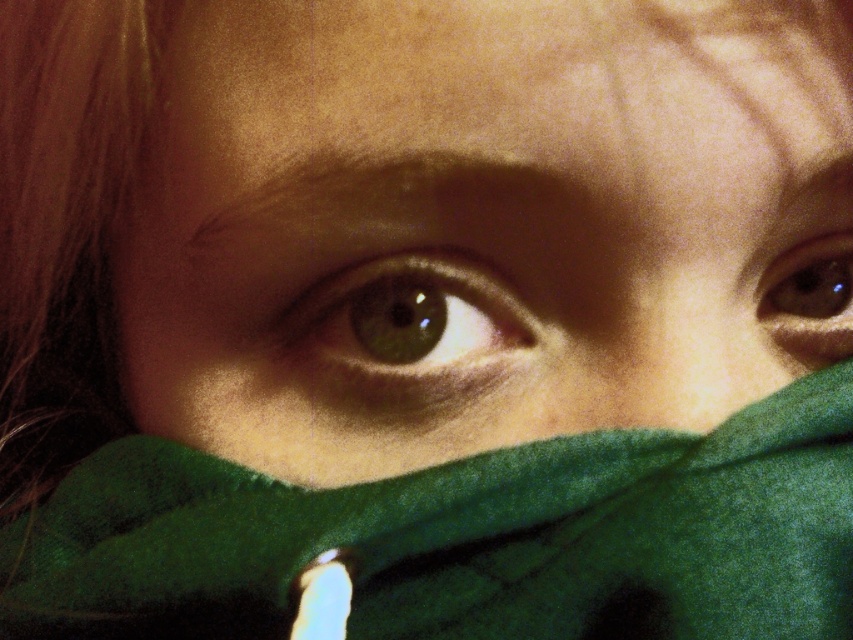
You are a photographer adjusting the focus on your camera. You want to ensure the green fleece scarf at center is in sharp focus. Based on its position, where should you adjust the focus point to? Please provide coordinates in the format of a point like this example format for reference, but do not include any other details. The answer should be in the format of a point like this example format for reference, but do not include any other details. The answer should be in the format of a point like this. The

The green fleece scarf at center is located at point [465,538], so you should adjust the focus point to [465,538] to ensure it is in sharp focus.